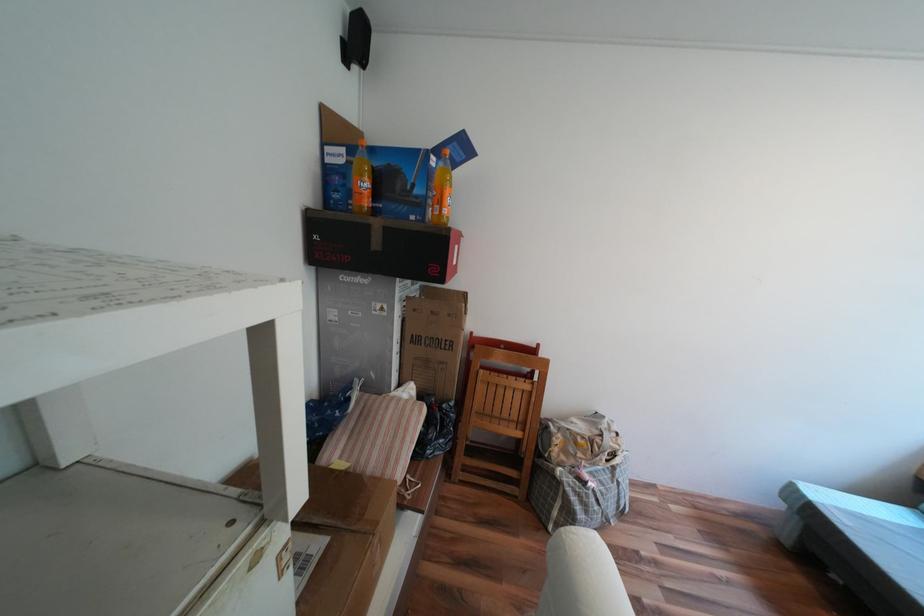
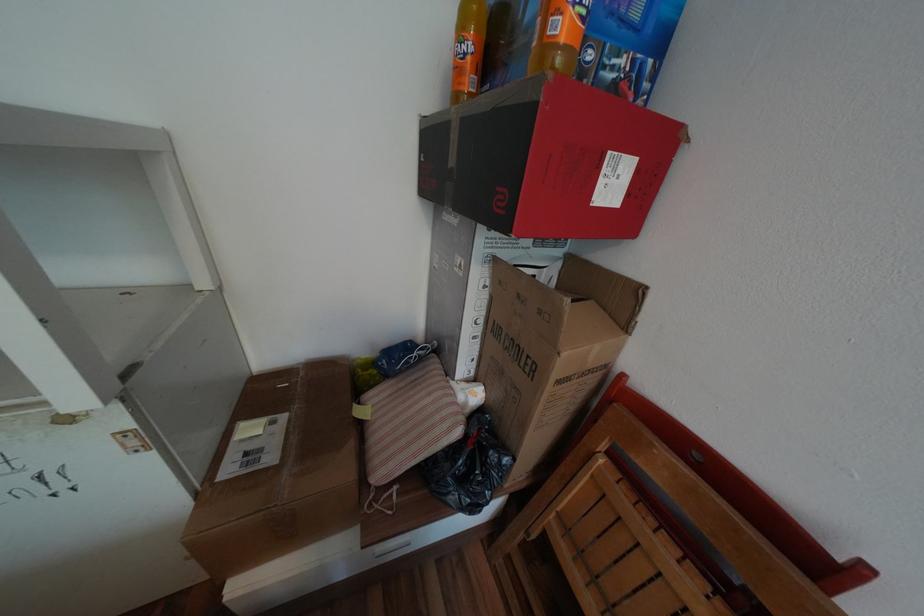
Locate, in the second image, the point that corresponds to [420,411] in the first image.

(453, 419)